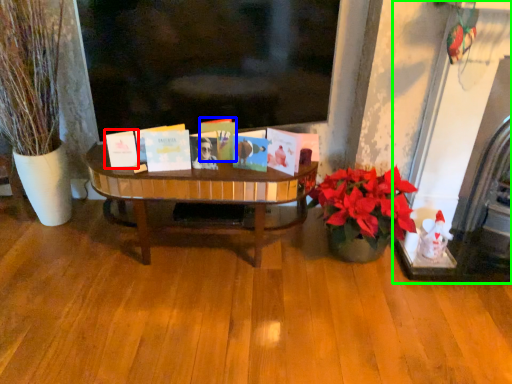
Question: Which is nearer to the book (highlighted by a red box)? book (highlighted by a blue box) or fireplace (highlighted by a green box).

Choices:
 (A) book
 (B) fireplace

Answer: (A)